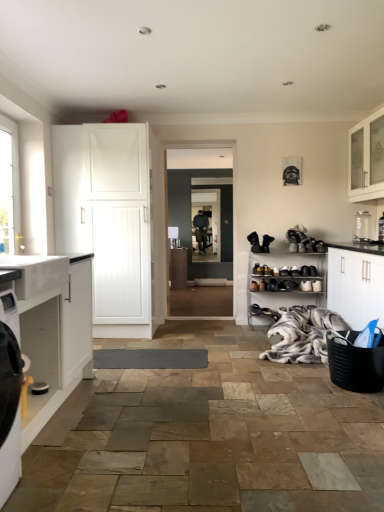
The height and width of the screenshot is (512, 384). What are the coordinates of `white fur blanket at lower right` in the screenshot? It's located at (x=303, y=335).

Measure the distance between white glossy countertop at lower left and camera.

The distance of white glossy countertop at lower left from camera is 2.45 meters.

The width and height of the screenshot is (384, 512). What do you see at coordinates (178, 268) in the screenshot? I see `matte wood cabinet at center, the 6th cabinetry from the front` at bounding box center [178, 268].

The height and width of the screenshot is (512, 384). What do you see at coordinates (362, 227) in the screenshot? I see `clear glass container at upper right` at bounding box center [362, 227].

What is the approximate width of black leather shoe at center, which is the 6th shoe from left to right?

8.55 inches.

Locate an element on the screen. black leather shoe at center, which is the 6th shoe from left to right is located at coordinates (311, 245).

Identify the location of white fur blanket at lower right. This screenshot has width=384, height=512. (303, 335).

Consider the image. Does shiny black shoe at lower right, placed as the seventh shoe when sorted from right to left, have a lesser height compared to matte black shoe at lower center, positioned as the 4th shoe in left-to-right order?

No.

From the image's perspective, would you say shiny black shoe at lower right, marked as the 1th shoe in a left-to-right arrangement, is shown under matte black shoe at lower center, the fourth shoe from the right?

Actually, shiny black shoe at lower right, marked as the 1th shoe in a left-to-right arrangement, appears above matte black shoe at lower center, the fourth shoe from the right, in the image.

Is the surface of shiny black shoe at lower right, placed as the seventh shoe when sorted from right to left, in direct contact with matte black shoe at lower center, the fourth shoe from the right?

No, shiny black shoe at lower right, placed as the seventh shoe when sorted from right to left, is not with matte black shoe at lower center, the fourth shoe from the right.

Based on the photo, from a real-world perspective, which is physically above, shiny black shoe at lower right, placed as the seventh shoe when sorted from right to left, or matte black shoe at lower center, positioned as the 4th shoe in left-to-right order?

In real-world perspective, shiny black shoe at lower right, placed as the seventh shoe when sorted from right to left, is above.

Is white matte cabinet at left, marked as the 3th cabinetry in a back-to-front arrangement, positioned with its back to matte wood cabinet at center, the 3th cabinetry when ordered from left to right?

Answer: Yes, white matte cabinet at left, marked as the 3th cabinetry in a back-to-front arrangement, is facing away from matte wood cabinet at center, the 3th cabinetry when ordered from left to right.

Considering the relative positions of white matte cabinet at left, which is the fourth cabinetry in front-to-back order, and matte wood cabinet at center, placed as the first cabinetry when sorted from back to front, in the image provided, is white matte cabinet at left, which is the fourth cabinetry in front-to-back order, to the right of matte wood cabinet at center, placed as the first cabinetry when sorted from back to front, from the viewer's perspective?

No.

Is white matte cabinet at left, marked as the 3th cabinetry in a back-to-front arrangement, completely or partially outside of matte wood cabinet at center, the 6th cabinetry from the front?

Yes, white matte cabinet at left, marked as the 3th cabinetry in a back-to-front arrangement, is not within matte wood cabinet at center, the 6th cabinetry from the front.

Is white matte cabinet at left, marked as the 3th cabinetry in a back-to-front arrangement, further to the viewer compared to matte wood cabinet at center, placed as the 4th cabinetry when sorted from right to left?

No, white matte cabinet at left, marked as the 3th cabinetry in a back-to-front arrangement, is closer to the camera.

Can you confirm if white matte cabinet at left, positioned as the 2th cabinetry in left-to-right order, is bigger than white glossy countertop at lower left?

Indeed, white matte cabinet at left, positioned as the 2th cabinetry in left-to-right order, has a larger size compared to white glossy countertop at lower left.

In the scene shown: Which object is closer to the camera taking this photo, white matte cabinet at left, the fifth cabinetry viewed from the right, or white glossy countertop at lower left?

white glossy countertop at lower left.

Is white matte cabinet at left, which is the fourth cabinetry in front-to-back order, shorter than white glossy countertop at lower left?

Incorrect, the height of white matte cabinet at left, which is the fourth cabinetry in front-to-back order, does not fall short of that of white glossy countertop at lower left.

At what (x,y) coordinates should I click in order to perform the action: click on countertop in front of the white matte cabinet at left, positioned as the 2th cabinetry in left-to-right order. Please return your answer as a coordinate pair (x, y). Looking at the image, I should click on (77, 256).

Does point (224, 242) appear closer or farther from the camera than point (349, 149)?

Point (224, 242) is positioned farther from the camera compared to point (349, 149).

Based on the photo, considering the sizes of objects clear glass screen door at center and white glass cabinet at upper right, which ranks as the 3th cabinetry in front-to-back order, in the image provided, who is shorter, clear glass screen door at center or white glass cabinet at upper right, which ranks as the 3th cabinetry in front-to-back order,?

white glass cabinet at upper right, which ranks as the 3th cabinetry in front-to-back order, is shorter.

From a real-world perspective, is clear glass screen door at center physically below white glass cabinet at upper right, which ranks as the first cabinetry in right-to-left order?

Yes, from a real-world perspective, clear glass screen door at center is under white glass cabinet at upper right, which ranks as the first cabinetry in right-to-left order.

Find the location of a particular element. The image size is (384, 512). cabinetry above the clear glass screen door at center (from a real-world perspective) is located at coordinates (366, 158).

Find the location of a particular element. This screenshot has height=512, width=384. window that appears on the left of white fur blanket at lower right is located at coordinates (6, 194).

Which is correct: white fur blanket at lower right is inside clear glass window at left, or outside of it?

white fur blanket at lower right lies outside clear glass window at left.

What are the coordinates of `the 2nd shoe directly beneath the black leather shoe at lower right, which is the 1th shoe from right to left (from a real-world perspective)` in the screenshot? It's located at (272, 285).

Is black leather shoe at lower right, which is the 1th shoe from right to left, wider than matte black shoe at lower center, the fourth shoe from the right?

In fact, black leather shoe at lower right, which is the 1th shoe from right to left, might be narrower than matte black shoe at lower center, the fourth shoe from the right.

What's the angular difference between clear glass screen door at center and clear glass container at upper right's facing directions?

clear glass screen door at center and clear glass container at upper right are facing 90.2 degrees away from each other.

From the image's perspective, would you say clear glass screen door at center is positioned over clear glass container at upper right?

Yes, from the image's perspective, clear glass screen door at center is over clear glass container at upper right.

In the scene shown: Is clear glass screen door at center aimed at clear glass container at upper right?

No, clear glass screen door at center is not facing towards clear glass container at upper right.

Is clear glass screen door at center to the left or to the right of clear glass container at upper right in the image?

Clearly, clear glass screen door at center is on the left of clear glass container at upper right in the image.

The height and width of the screenshot is (512, 384). I want to click on the 3rd shoe positioned above the matte black shoe at lower center, the fourth shoe from the right (from the image's perspective), so click(258, 269).

There is a white matte cabinet at left, the fifth cabinetry viewed from the right. Identify the location of the 1st cabinetry below it (from the image's perspective). (178, 268).

When comparing their distances from black leather shoe at center, does black plastic basket at right, placed as the 5th cabinetry when sorted from back to front, or white fur blanket at lower right seem further?

black plastic basket at right, placed as the 5th cabinetry when sorted from back to front, is positioned further to the anchor black leather shoe at center.

When comparing their distances from white matte shoe at lower right, acting as the fifth shoe starting from the left, does black leather shoe at center, which is the 6th shoe from left to right, or clear glass container at upper right seem closer?

black leather shoe at center, which is the 6th shoe from left to right.

Which object lies further to the anchor point black leather shoe at center, white glossy countertop at lower left or white glass cabinet at upper right, the 4th cabinetry viewed from the back?

white glossy countertop at lower left is positioned further to the anchor black leather shoe at center.

Which object lies nearer to the anchor point black leather shoe at lower right, which is the 1th shoe from right to left, white matte cabinet at left, which is the sixth cabinetry in right-to-left order, or matte wood cabinet at center, placed as the first cabinetry when sorted from back to front?

white matte cabinet at left, which is the sixth cabinetry in right-to-left order.

When comparing their distances from shiny black shoe at lower right, placed as the seventh shoe when sorted from right to left, does white matte cabinet at left, marked as the 1th cabinetry in a left-to-right arrangement, or shiny black shoe at center, arranged as the 3th shoe when viewed from the left, seem further?

Among the two, white matte cabinet at left, marked as the 1th cabinetry in a left-to-right arrangement, is located further to shiny black shoe at lower right, placed as the seventh shoe when sorted from right to left.

From the image, which object appears to be nearer to white glass cabinet at upper right, which ranks as the 3th cabinetry in front-to-back order, black plastic basket at right, the fifth cabinetry in the left-to-right sequence, or shiny black shoe at center, arranged as the 3th shoe when viewed from the left?

black plastic basket at right, the fifth cabinetry in the left-to-right sequence, is closer to white glass cabinet at upper right, which ranks as the 3th cabinetry in front-to-back order.

When comparing their distances from white fur blanket at lower right, does black leather shoe at center, which is the second shoe from right to left, or black leather shoe at lower right, which is the 1th shoe from right to left, seem further?

black leather shoe at center, which is the second shoe from right to left, is further to white fur blanket at lower right.

Which object lies nearer to the anchor point shiny black shoe at lower right, placed as the seventh shoe when sorted from right to left, white fur blanket at lower right or matte black shoe at lower center, the fourth shoe from the right?

matte black shoe at lower center, the fourth shoe from the right, is positioned closer to the anchor shiny black shoe at lower right, placed as the seventh shoe when sorted from right to left.

You are a GUI agent. You are given a task and a screenshot of the screen. Output one action in this format:
    pyautogui.click(x=<x>, y=<y>)
    Task: Click on the material between white glossy countertop at lower left and brown leather shoe at lower center, acting as the 2th shoe starting from the left, in the front-back direction
    Image resolution: width=384 pixels, height=512 pixels.
    Given the screenshot: What is the action you would take?
    pyautogui.click(x=303, y=335)

The width and height of the screenshot is (384, 512). Identify the location of appliance between white matte cabinet at left, positioned as the 2th cabinetry in left-to-right order, and clear glass screen door at center, along the z-axis. (362, 227).

At what (x,y) coordinates should I click in order to perform the action: click on footwear between white fur blanket at lower right and matte wood cabinet at center, the 3th cabinetry when ordered from left to right, along the z-axis. Please return your answer as a coordinate pair (x, y). Looking at the image, I should click on (256, 309).

Locate an element on the screen. footwear between white matte cabinet at left, the sixth cabinetry from the back, and white glass cabinet at upper right, which ranks as the first cabinetry in right-to-left order is located at coordinates (256, 309).